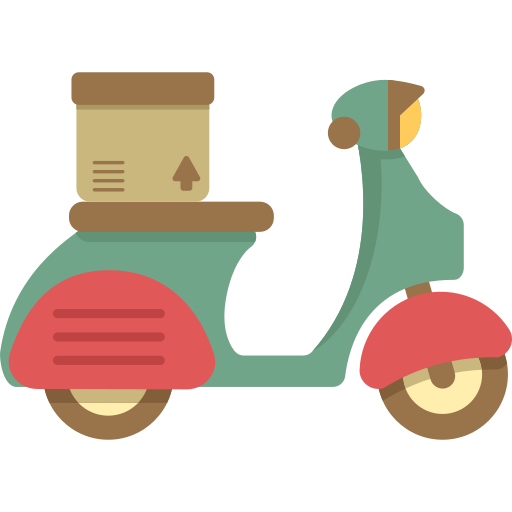
Find the location of a particular element. Image resolution: width=512 pixels, height=512 pixels. brown seat is located at coordinates tap(178, 214).